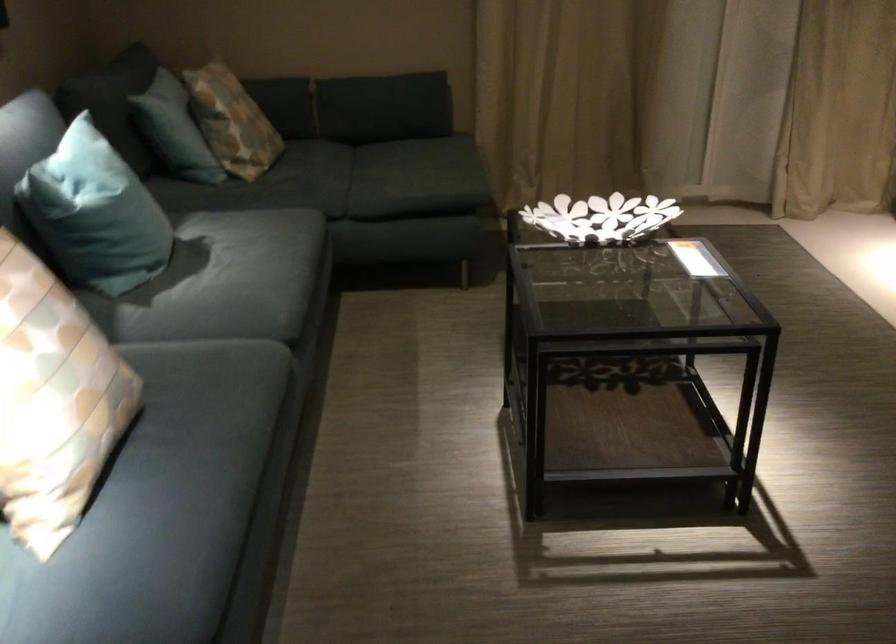
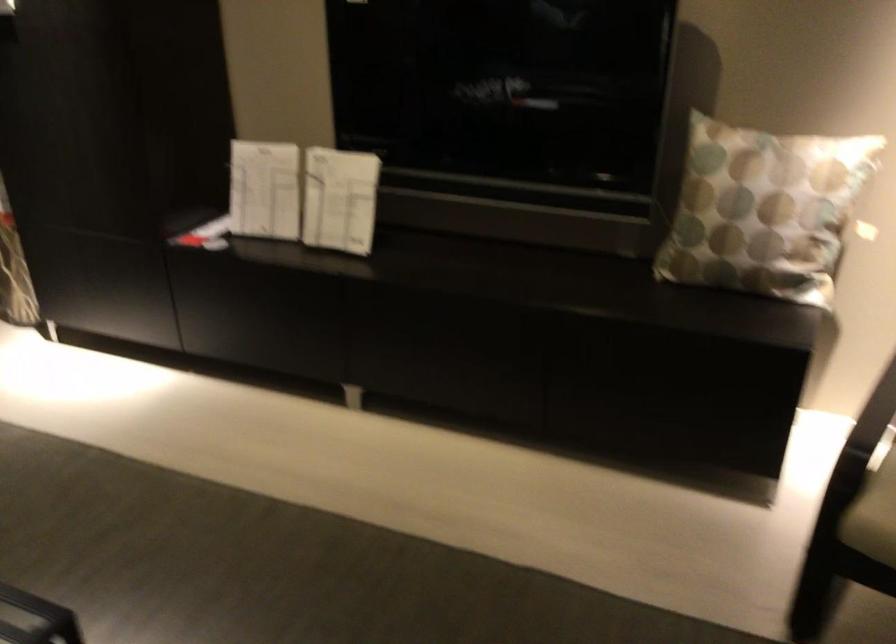
Question: The camera is either moving clockwise (left) or counter-clockwise (right) around the object. The first image is from the beginning of the video and the second image is from the end. Is the camera moving left or right when shooting the video?

Choices:
 (A) Left
 (B) Right

Answer: (A)